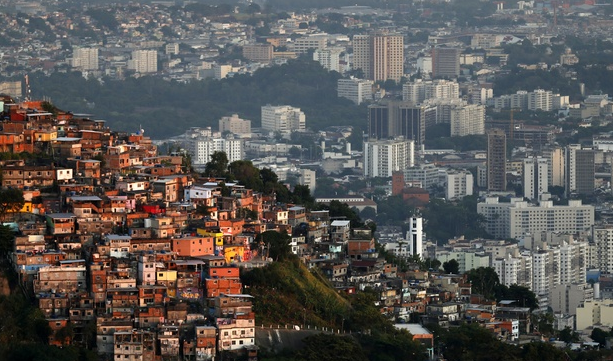
Where is `apartments`? The image size is (613, 361). apartments is located at coordinates (128, 353), (243, 331), (195, 245), (29, 172), (223, 216).